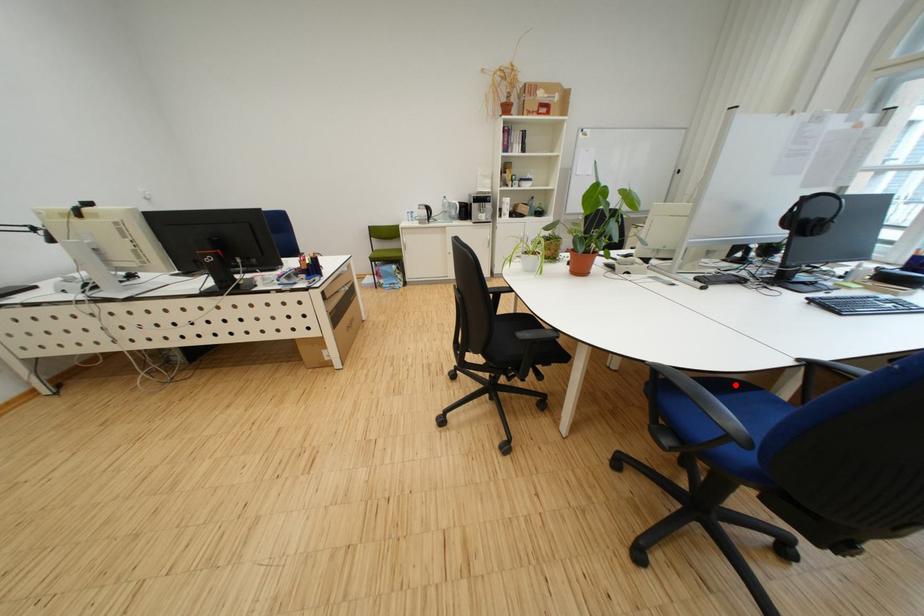
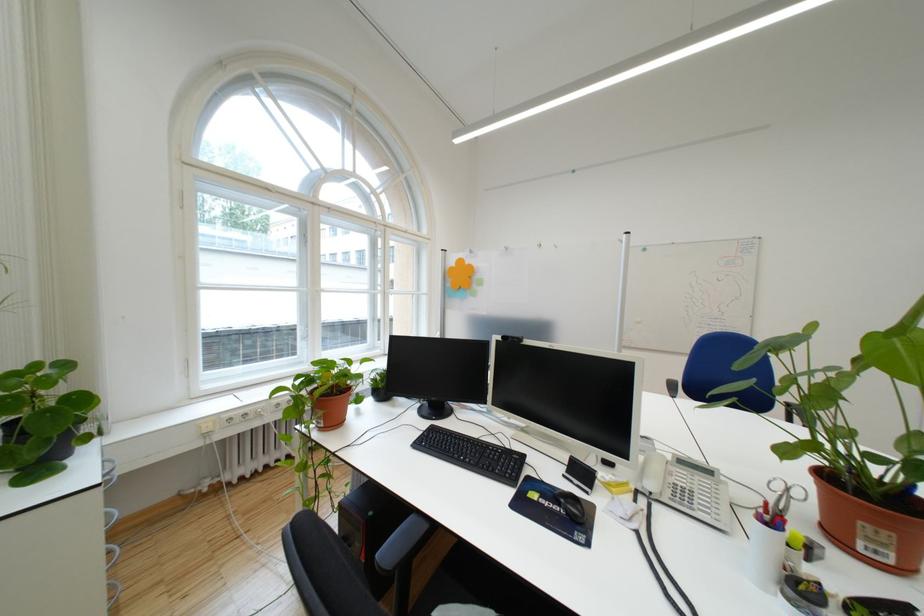
Question: I am providing you with two images of the same scene from different viewpoints. A red point is marked on the first image. Can you still see the location of the red point in image 2?

Choices:
 (A) Yes
 (B) No

Answer: (B)